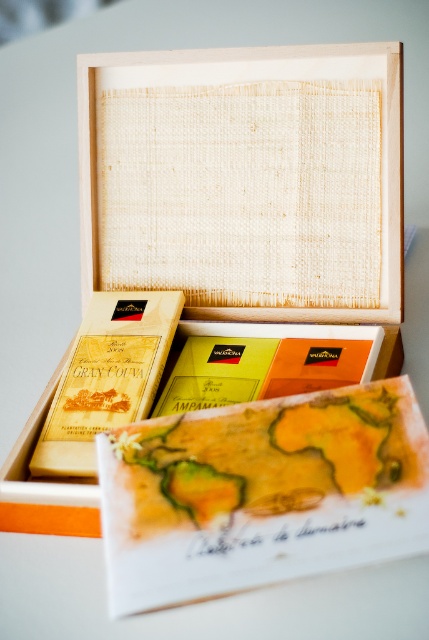
Question: Can you confirm if wooden box at center is positioned to the right of watercolor paper map at center?

Choices:
 (A) no
 (B) yes

Answer: (A)

Question: From the image, what is the correct spatial relationship of wooden box at center in relation to watercolor paper map at center?

Choices:
 (A) below
 (B) above

Answer: (B)

Question: Is wooden box at center to the right of watercolor paper map at center from the viewer's perspective?

Choices:
 (A) no
 (B) yes

Answer: (A)